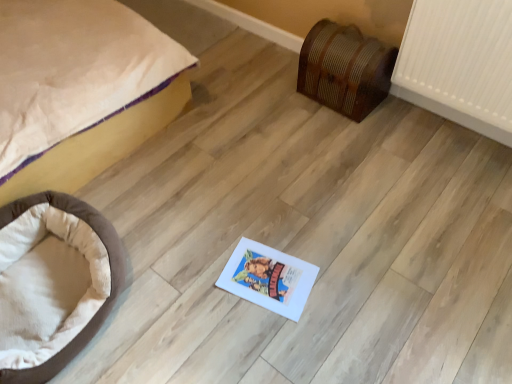
Question: Considering the positions of beige fabric bed at left and wooden chest at right in the image, is beige fabric bed at left taller or shorter than wooden chest at right?

Choices:
 (A) short
 (B) tall

Answer: (B)

Question: From the image's perspective, relative to wooden chest at right, is beige fabric bed at left above or below?

Choices:
 (A) above
 (B) below

Answer: (A)

Question: Estimate the real-world distances between objects in this image. Which object is closer to the wooden chest at right?

Choices:
 (A) brown plush dog bed at lower left
 (B) beige fabric bed at left

Answer: (B)

Question: Estimate the real-world distances between objects in this image. Which object is farther from the brown plush dog bed at lower left?

Choices:
 (A) beige fabric bed at left
 (B) wooden chest at right

Answer: (B)